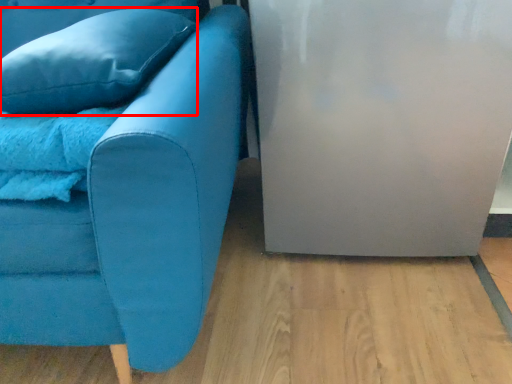
Question: From the image's perspective, where is pillow (annotated by the red box) located in relation to studio couch in the image?

Choices:
 (A) above
 (B) below

Answer: (A)